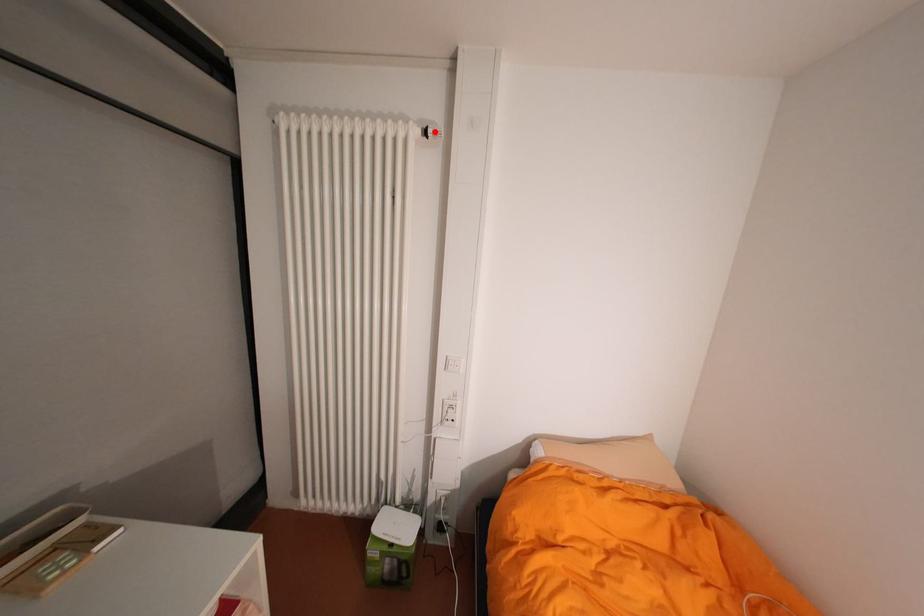
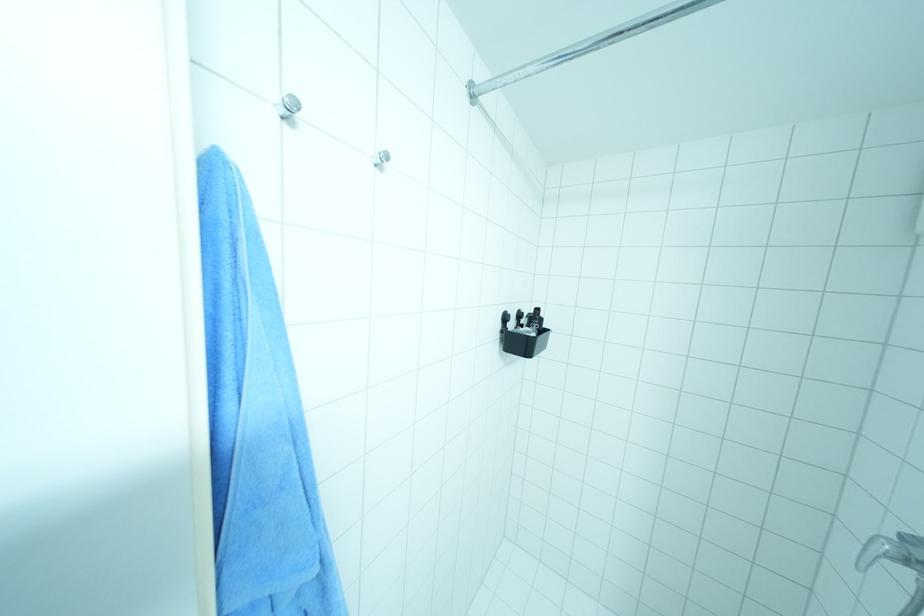
Question: I am providing you with two images of the same scene from different viewpoints. A red point is marked on the first image. At the location where the point appears in image 1, is it still visible in image 2?

Choices:
 (A) Yes
 (B) No

Answer: (B)